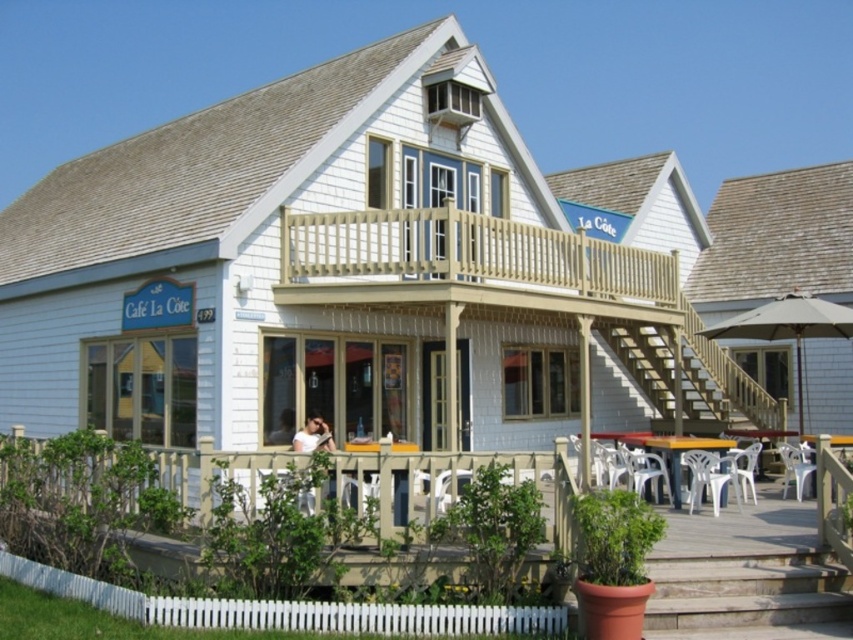
A customer wearing a white fabric shirt at lower center wants to order a drink for someone sitting at the table on the balcony. The balcony is 75.76 feet away. Is the distance too far for the customer to shout the order?

The distance between the white fabric shirt at lower center and the balcony is 75.76 feet. Shouting over such a long distance might be difficult, so it would be better to use another method like a waiter to deliver the order.

You are a customer at the Cafe La Cote and you want to sit at a table that has a view of both the white fabric shirt at lower center and the smooth skin face at center. Which table should you choose?

You should choose a table that allows you to see both the white fabric shirt at lower center and the smooth skin face at center. Since the white fabric shirt at lower center might be wider than the smooth skin face at center, you need to ensure your view accommodates the wider object.